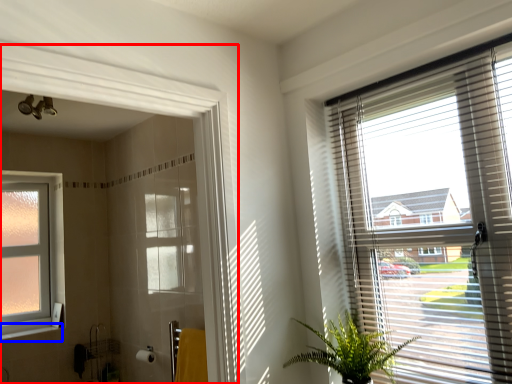
Question: Which object appears farthest to the camera in this image, screen door (highlighted by a red box) or window sill (highlighted by a blue box)?

Choices:
 (A) screen door
 (B) window sill

Answer: (B)